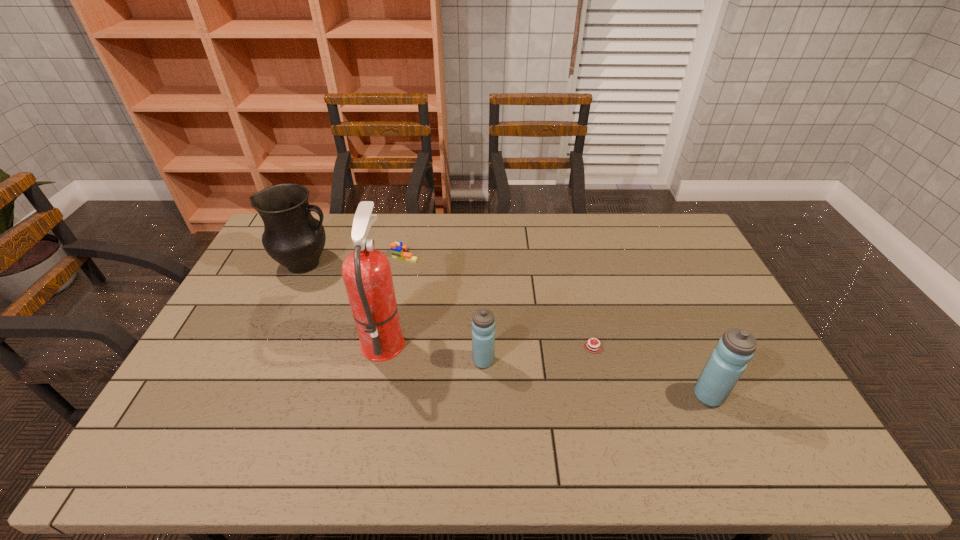
This screenshot has height=540, width=960. I want to click on object located in the far left corner section of the desktop, so click(292, 236).

I want to click on object that is at the near right corner, so click(x=728, y=361).

Locate an element on the screen. The height and width of the screenshot is (540, 960). vacant position at the far edge of the desktop is located at coordinates [618, 225].

At what (x,y) coordinates should I click in order to perform the action: click on vacant space at the near edge. Please return your answer as a coordinate pair (x, y). This screenshot has width=960, height=540. Looking at the image, I should click on (246, 394).

You are a GUI agent. You are given a task and a screenshot of the screen. Output one action in this format:
    pyautogui.click(x=<x>, y=<y>)
    Task: Click on the free space at the left edge of the desktop
    The width and height of the screenshot is (960, 540).
    Given the screenshot: What is the action you would take?
    click(201, 359)

This screenshot has width=960, height=540. What are the coordinates of `vacant space at the right edge of the desktop` in the screenshot? It's located at (703, 338).

At what (x,y) coordinates should I click in order to perform the action: click on free location at the far right corner. Please return your answer as a coordinate pair (x, y). This screenshot has width=960, height=540. Looking at the image, I should click on (671, 217).

In order to click on vacant space that's between the left water bottle and the shortest object in this screenshot , I will do `click(539, 354)`.

Where is `free space between the third object from right to left and the chocolate cake`? free space between the third object from right to left and the chocolate cake is located at coordinates (539, 354).

You are a GUI agent. You are given a task and a screenshot of the screen. Output one action in this format:
    pyautogui.click(x=<x>, y=<y>)
    Task: Click on the vacant space that's between the farther water bottle and the taller water bottle
    The height and width of the screenshot is (540, 960).
    Given the screenshot: What is the action you would take?
    pyautogui.click(x=596, y=378)